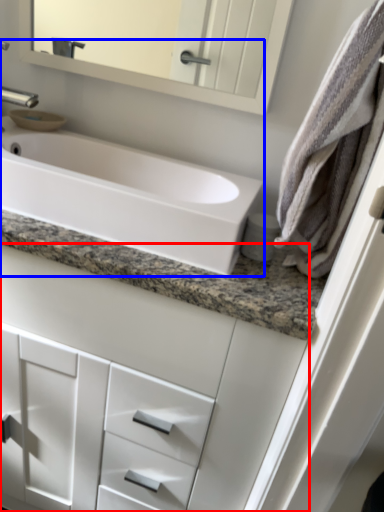
Question: Which object is further to the camera taking this photo, bathroom cabinet (highlighted by a red box) or sink (highlighted by a blue box)?

Choices:
 (A) bathroom cabinet
 (B) sink

Answer: (B)